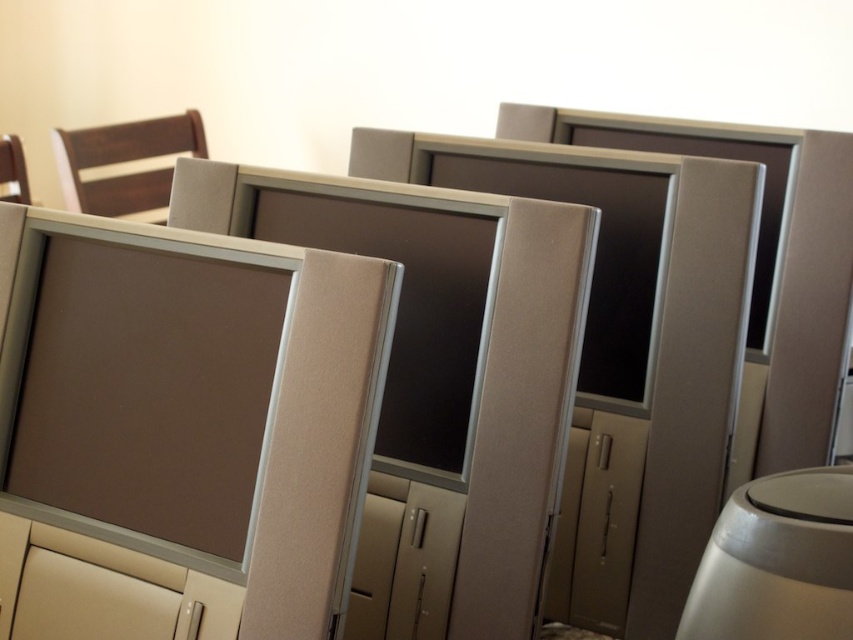
Can you confirm if white glossy table at lower right is thinner than dark wood chair at upper left?

Correct, white glossy table at lower right's width is less than dark wood chair at upper left's.

Locate an element on the screen. The width and height of the screenshot is (853, 640). white glossy table at lower right is located at coordinates (776, 561).

Is satin silver monitor at center smaller than white glossy table at lower right?

No.

Who is more forward, (x=456, y=140) or (x=793, y=620)?

Point (x=793, y=620)

The height and width of the screenshot is (640, 853). What are the coordinates of `satin silver monitor at center` in the screenshot? It's located at (572, 202).

Does satin silver monitor at center have a smaller size compared to matte brown chair at left?

Actually, satin silver monitor at center might be larger than matte brown chair at left.

How much distance is there between satin silver monitor at center and matte brown chair at left?

satin silver monitor at center is 4.08 feet from matte brown chair at left.

Identify the location of satin silver monitor at center. (572, 202).